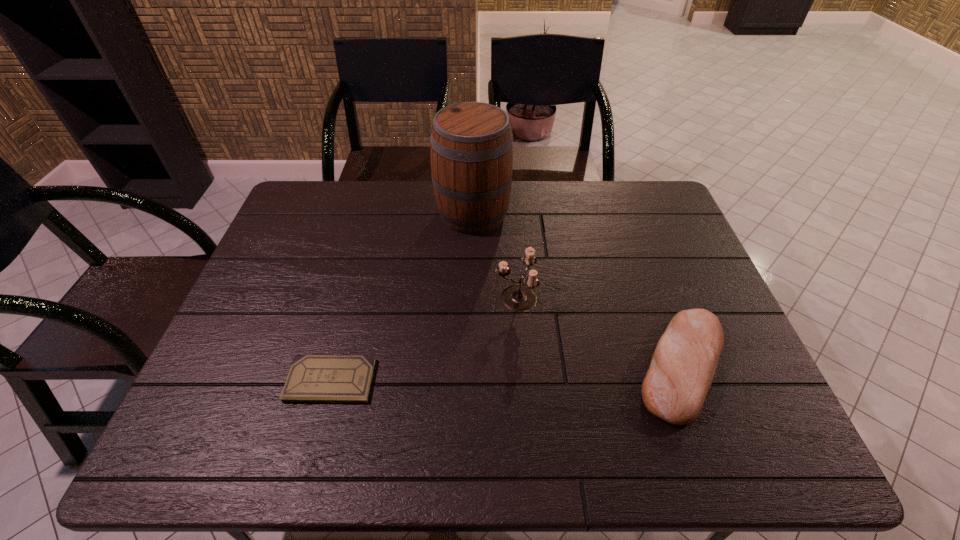
Identify the location of vacant region between the farthest object and the third tallest object. (577, 290).

Where is `object that stands as the third closest to the bread`? The image size is (960, 540). object that stands as the third closest to the bread is located at coordinates (312, 378).

Find the location of `object that is the third closest one to the cider`. object that is the third closest one to the cider is located at coordinates (312, 378).

Where is `vacant space that satisfies the following two spatial constraints: 1. on the front side of the second tallest object; 2. on the right side of the second shortest object`? The image size is (960, 540). vacant space that satisfies the following two spatial constraints: 1. on the front side of the second tallest object; 2. on the right side of the second shortest object is located at coordinates (521, 366).

This screenshot has height=540, width=960. I want to click on blank area in the image that satisfies the following two spatial constraints: 1. on the front side of the candle holder; 2. on the left side of the bread, so click(x=521, y=366).